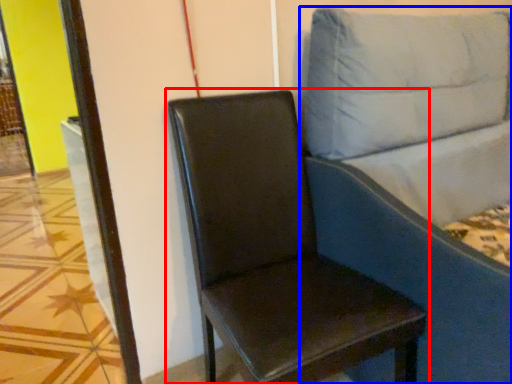
Question: Which of the following is the farthest to the observer, chair (highlighted by a red box) or studio couch (highlighted by a blue box)?

Choices:
 (A) chair
 (B) studio couch

Answer: (A)